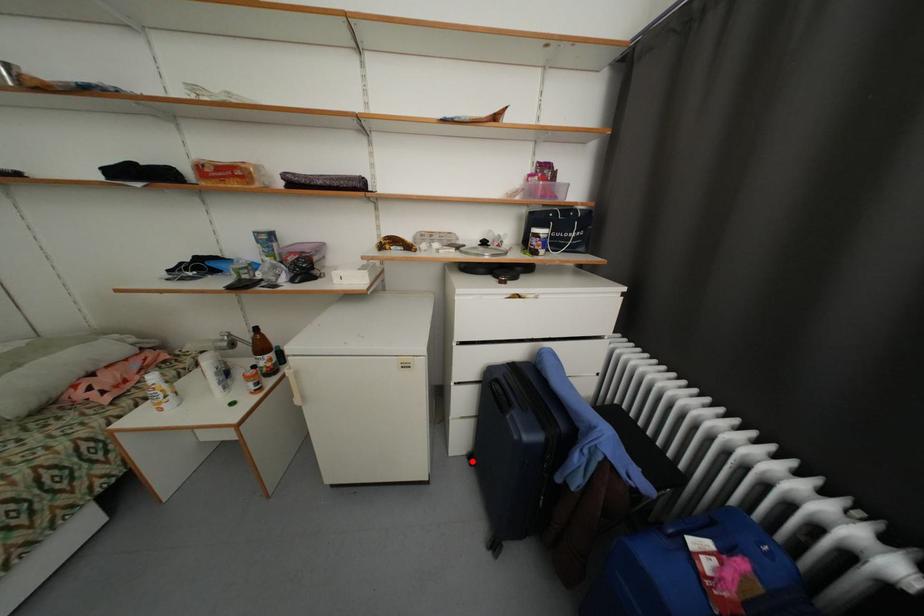
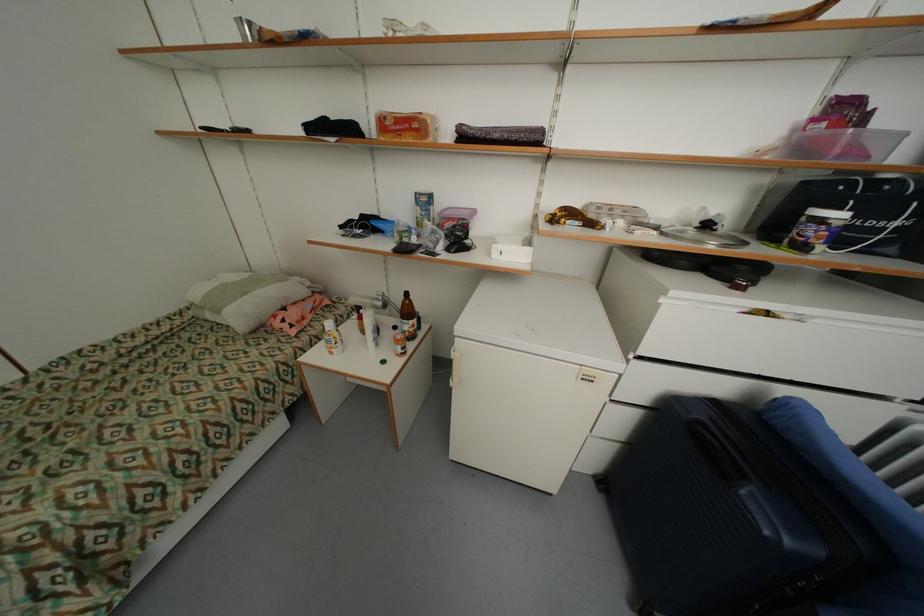
Where in the second image is the point corresponding to the highlighted location from the first image?

(599, 483)